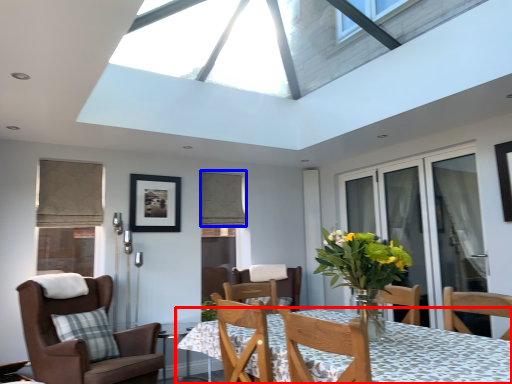
Question: Which point is further to the camera, table (highlighted by a red box) or curtain (highlighted by a blue box)?

Choices:
 (A) table
 (B) curtain

Answer: (B)